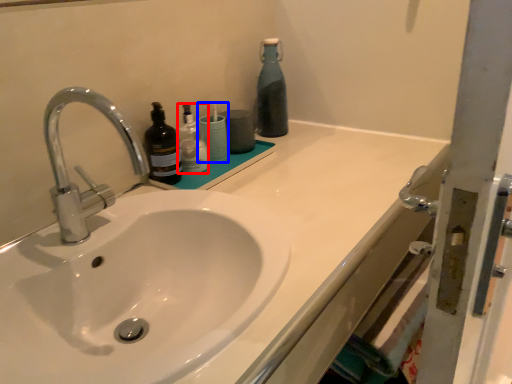
Question: Which object is further to the camera taking this photo, bottle (highlighted by a red box) or toiletry (highlighted by a blue box)?

Choices:
 (A) bottle
 (B) toiletry

Answer: (B)